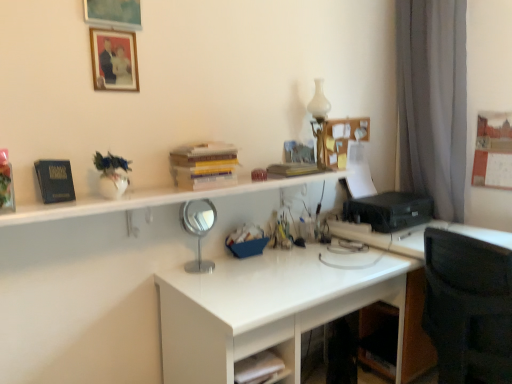
What are the coordinates of `vacant area that is in front of polished silver mirror at center` in the screenshot? It's located at (201, 283).